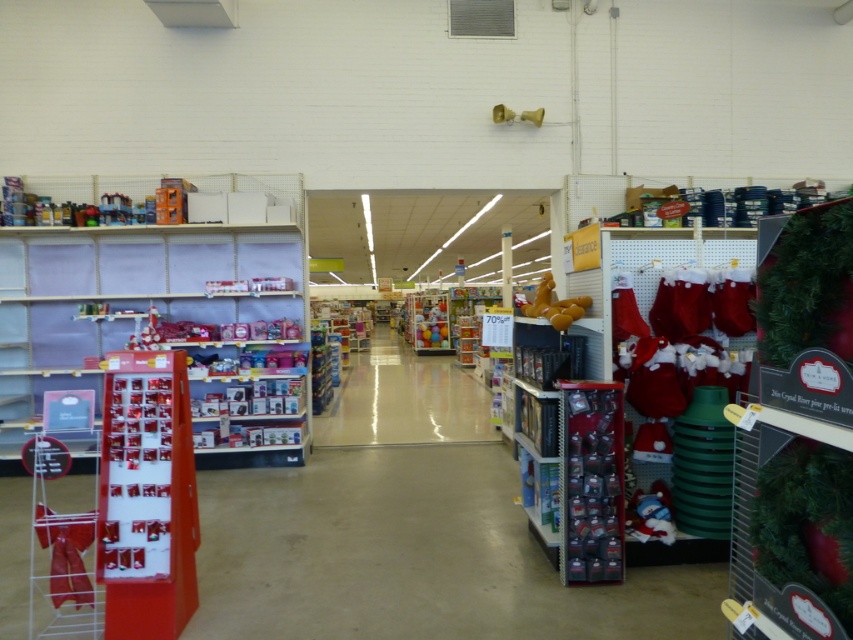
Question: Does matte plastic toy at center have a greater width compared to matte yellow toy at upper center?

Choices:
 (A) yes
 (B) no

Answer: (A)

Question: Which object is farther from the camera taking this photo?

Choices:
 (A) matte plastic shelves at upper left
 (B) matte yellow toy at upper center
 (C) matte plastic toy at center
 (D) velvety plush toy at lower right

Answer: (C)

Question: Does matte plastic shelves at upper left come behind velvety plush toy at lower right?

Choices:
 (A) no
 (B) yes

Answer: (B)

Question: Does matte plastic shelves at upper left lie behind matte yellow toy at upper center?

Choices:
 (A) yes
 (B) no

Answer: (A)

Question: Which of the following is the farthest from the observer?

Choices:
 (A) metallic silver ornaments at right
 (B) matte yellow toy at upper center

Answer: (B)

Question: Which point is farther to the camera?

Choices:
 (A) 526,305
 (B) 213,236
 (C) 590,552
 (D) 665,484

Answer: (B)